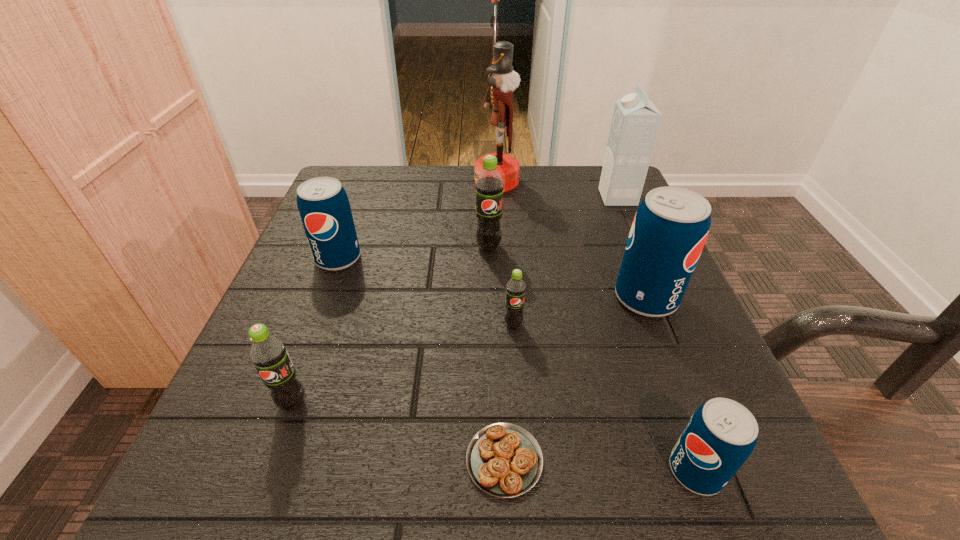
This screenshot has width=960, height=540. What are the coordinates of `object that is at the far right corner` in the screenshot? It's located at (635, 123).

You are a GUI agent. You are given a task and a screenshot of the screen. Output one action in this format:
    pyautogui.click(x=<x>, y=<y>)
    Task: Click on the object located in the near right corner section of the desktop
    This screenshot has width=960, height=540.
    Given the screenshot: What is the action you would take?
    pyautogui.click(x=720, y=436)

Locate an element on the screen. The width and height of the screenshot is (960, 540). vacant area at the far edge is located at coordinates (420, 184).

Identify the location of free space at the near edge of the desktop. (312, 516).

You are a GUI agent. You are given a task and a screenshot of the screen. Output one action in this format:
    pyautogui.click(x=<x>, y=<y>)
    Task: Click on the vacant region at the left edge of the desktop
    The image size is (960, 540).
    Given the screenshot: What is the action you would take?
    pyautogui.click(x=330, y=416)

You are a GUI agent. You are given a task and a screenshot of the screen. Output one action in this format:
    pyautogui.click(x=<x>, y=<y>)
    Task: Click on the blank space at the right edge of the desktop
    The width and height of the screenshot is (960, 540).
    Given the screenshot: What is the action you would take?
    pyautogui.click(x=588, y=251)

This screenshot has height=540, width=960. In the image, there is a desktop. In order to click on free space at the far right corner in this screenshot , I will do `click(565, 165)`.

Image resolution: width=960 pixels, height=540 pixels. I want to click on free space between the pastry and the carton, so click(561, 329).

Identify the location of free space between the second farthest blue pop and the nutcracker. The width and height of the screenshot is (960, 540). (571, 239).

Find the location of a particular element. The width and height of the screenshot is (960, 540). unoccupied area between the farthest green soda and the biggest blue pop is located at coordinates (567, 273).